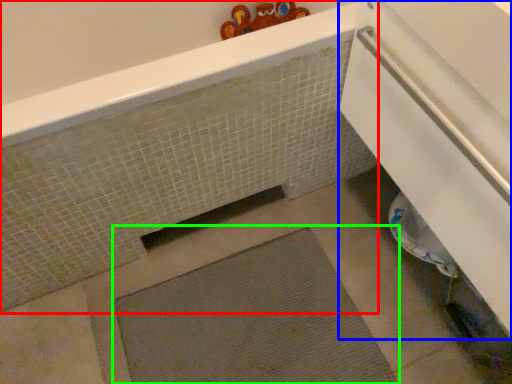
Question: Which object is the closest to the bath (highlighted by a red box)? Choose among these: screen door (highlighted by a blue box) or bath mat (highlighted by a green box).

Choices:
 (A) screen door
 (B) bath mat

Answer: (B)